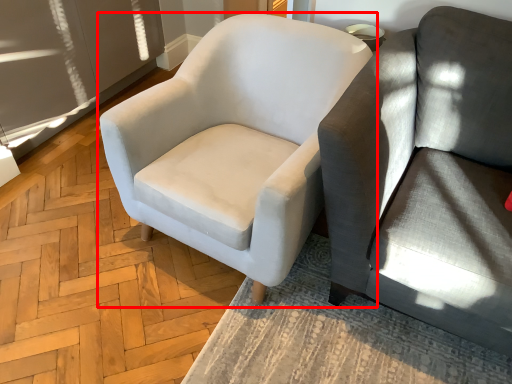
Question: From the image, what is the correct spatial relationship of chair (annotated by the red box) in relation to studio couch?

Choices:
 (A) right
 (B) left

Answer: (B)